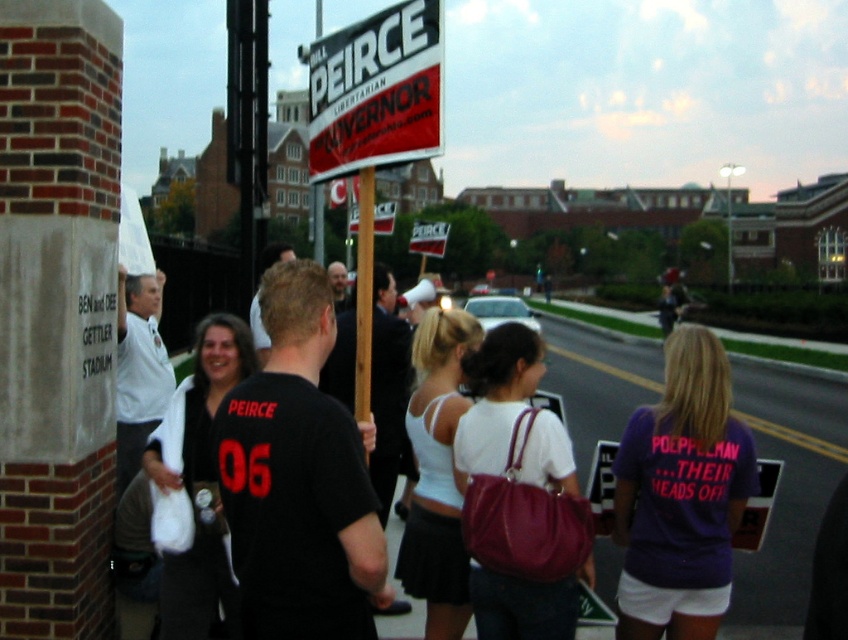
Question: Which object is positioned closest to the black matte shirt at center?

Choices:
 (A) red/black plastic sign at upper center
 (B) wooden pole at center
 (C) dark brown hair at center

Answer: (B)

Question: Among these objects, which one is nearest to the camera?

Choices:
 (A) dark brown hair at center
 (B) white shirt at left
 (C) wooden pole at center

Answer: (C)

Question: In this image, where is wooden pole at center located relative to white plastic sign at center?

Choices:
 (A) right
 (B) left

Answer: (B)

Question: Is white plastic sign at center bigger than dark brown hair at center?

Choices:
 (A) no
 (B) yes

Answer: (B)

Question: Among these points, which one is nearest to the camera?

Choices:
 (A) (135, 429)
 (B) (354, 388)
 (C) (349, 326)
 (D) (285, 419)

Answer: (D)

Question: Is black matte shirt at center smaller than dark brown hair at center?

Choices:
 (A) yes
 (B) no

Answer: (A)